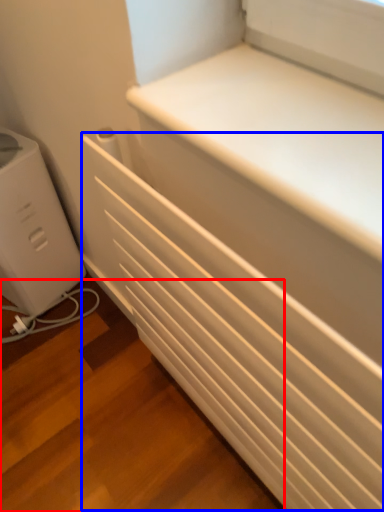
Question: Which object appears farthest to the camera in this image, stairwell (highlighted by a red box) or radiator (highlighted by a blue box)?

Choices:
 (A) stairwell
 (B) radiator

Answer: (A)